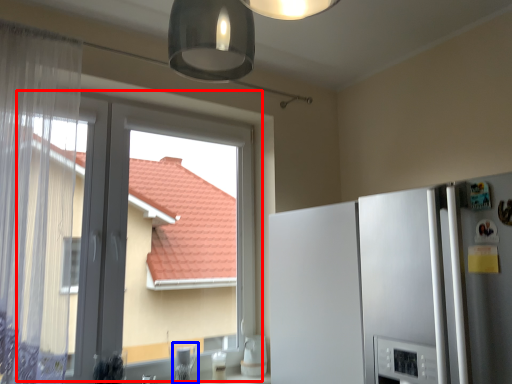
Question: Which point is closer to the camera, window (highlighted by a red box) or appliance (highlighted by a blue box)?

Choices:
 (A) window
 (B) appliance

Answer: (A)